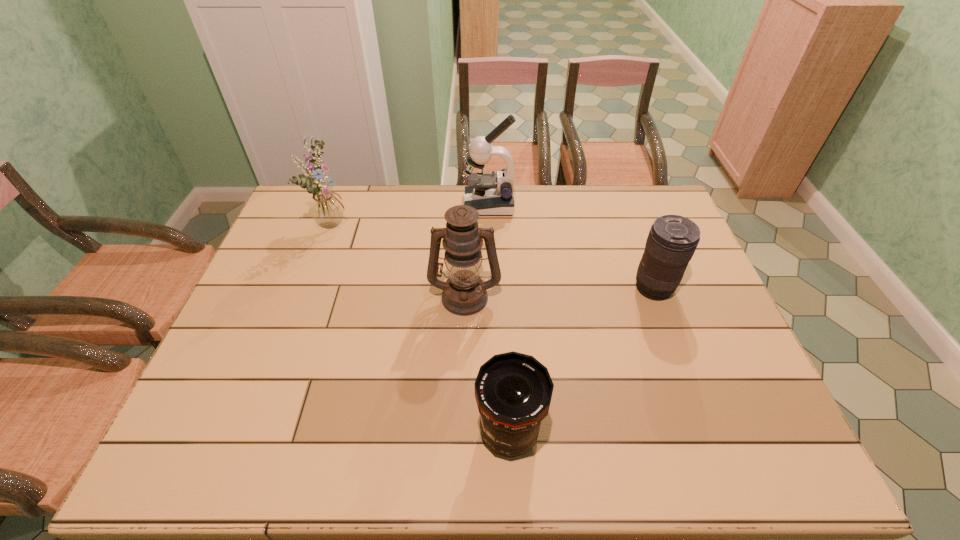
Locate an element on the screen. The width and height of the screenshot is (960, 540). free point between the oil lamp and the bouquet is located at coordinates (399, 259).

Where is `vacant area that lies between the microscope and the left telephoto lens`? The width and height of the screenshot is (960, 540). vacant area that lies between the microscope and the left telephoto lens is located at coordinates (499, 319).

Locate an element on the screen. Image resolution: width=960 pixels, height=540 pixels. object that ranks as the third closest to the right telephoto lens is located at coordinates (513, 391).

Where is `the closest object to the microscope`? This screenshot has width=960, height=540. the closest object to the microscope is located at coordinates (464, 293).

Find the location of a particular element. The image size is (960, 540). free location that satisfies the following two spatial constraints: 1. on the front-facing side of the nearer telephoto lens; 2. on the right side of the leftmost object is located at coordinates (256, 433).

The width and height of the screenshot is (960, 540). I want to click on vacant space that satisfies the following two spatial constraints: 1. on the front-facing side of the bouquet; 2. on the back side of the nearer telephoto lens, so click(256, 433).

Identify the location of free point that satisfies the following two spatial constraints: 1. on the front-facing side of the left telephoto lens; 2. on the left side of the leftmost object. (256, 433).

Find the location of a particular element. The image size is (960, 540). vacant space that satisfies the following two spatial constraints: 1. on the side of the rightmost object where the control switches are located; 2. on the front side of the oil lamp is located at coordinates (656, 296).